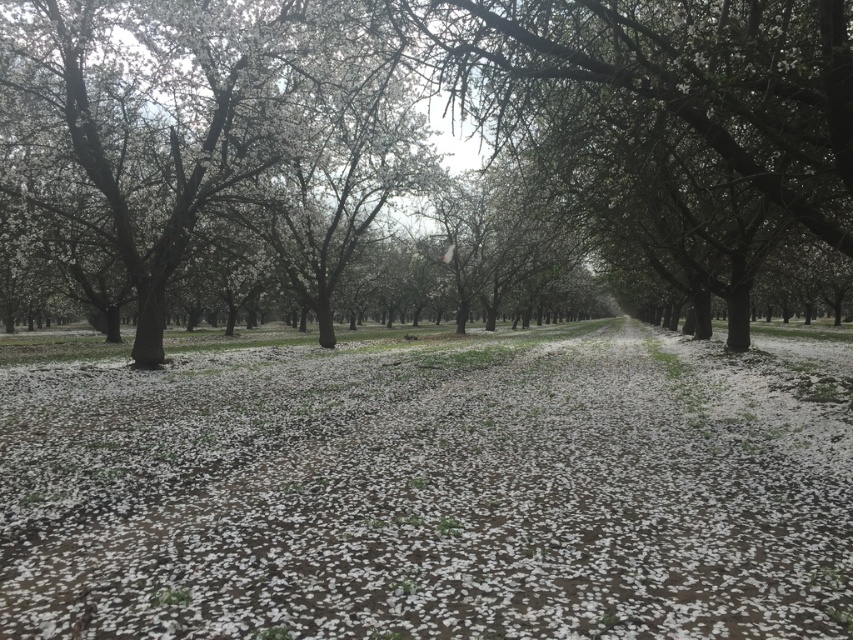
Measure the distance from white matte petals at center to white blossoms at center.

They are 7.42 meters apart.

Can you confirm if white matte petals at center is shorter than white blossoms at center?

Yes.

I want to click on white matte petals at center, so click(432, 492).